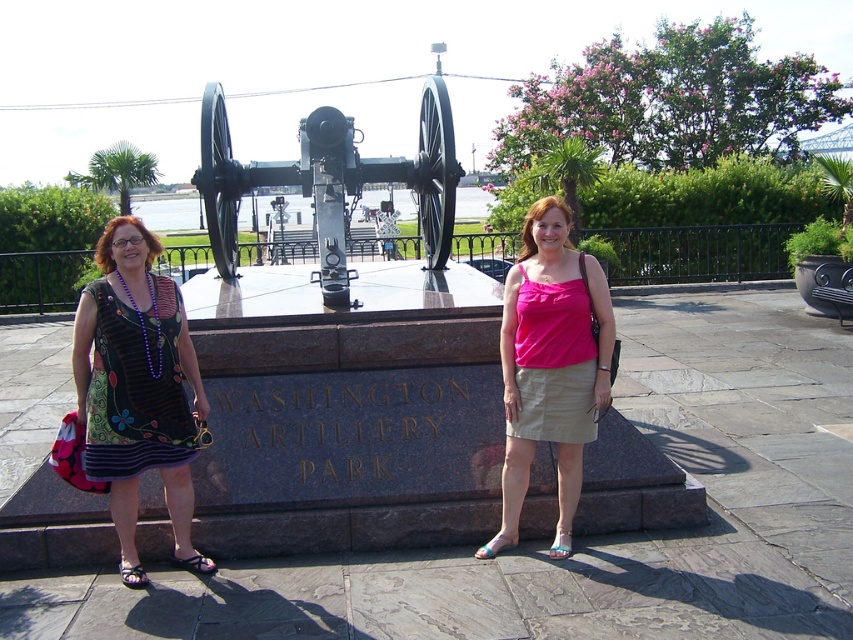
You are a photographer planning to take a portrait of the two women at Washington Artillery Park. You notice the floral dress at left and the pink fabric tank top at center. Which clothing item appears narrower when viewed from your camera angle?

The floral dress at left appears narrower than the pink fabric tank top at center when viewed from the camera angle.

You are a photographer planning to take a group photo of the two women at Washington Artillery Park. The floral dress at left and pink fabric tank top at center are the subjects. Your camera has a maximum focus range of 2 meters. Will you be able to capture both subjects in focus without moving either of them?

The floral dress at left and pink fabric tank top at center are 2.20 meters apart. Since the camera can only focus within 2 meters, the distance between them exceeds the focus range. Therefore, you cannot capture both subjects in focus without adjusting their positions.

You are standing in front of the historical cannon monument at Washington Artillery Park. There are two points marked in the scene. Which point, point (129, 344) or point (514, 276), is closer to you?

Point (129, 344) is closer to the viewer than point (514, 276).